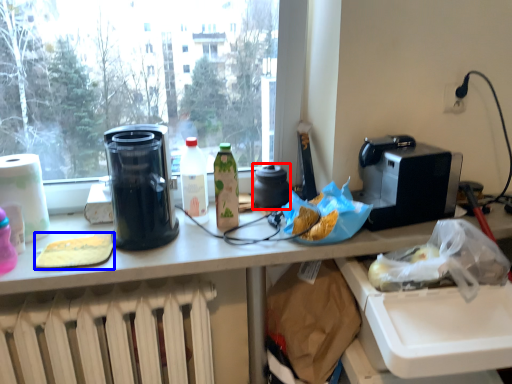
Question: Which object appears farthest to the camera in this image, appliance (highlighted by a red box) or food (highlighted by a blue box)?

Choices:
 (A) appliance
 (B) food

Answer: (A)